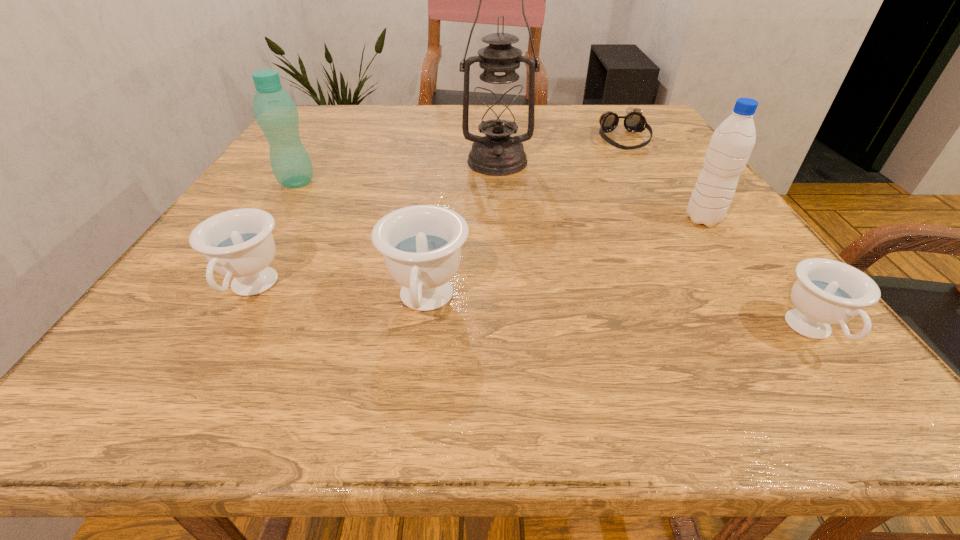
This screenshot has height=540, width=960. Find the location of `vacant area located on the back of the oil lamp`. vacant area located on the back of the oil lamp is located at coordinates (494, 114).

Locate an element on the screen. vacant region located 0.100m on the left of the water bottle is located at coordinates (633, 219).

This screenshot has width=960, height=540. Find the location of `free region located on the front of the bottle`. free region located on the front of the bottle is located at coordinates (214, 313).

Identify the location of object at the far edge. The height and width of the screenshot is (540, 960). (634, 121).

Locate an element on the screen. This screenshot has height=540, width=960. teacup positioned at the left edge is located at coordinates (238, 243).

Image resolution: width=960 pixels, height=540 pixels. I want to click on bottle at the left edge, so click(x=276, y=113).

What are the coordinates of `teacup that is at the right edge` in the screenshot? It's located at (827, 291).

This screenshot has width=960, height=540. In order to click on goggles at the right edge in this screenshot , I will do `click(634, 121)`.

Where is `water bottle located at the right edge`? water bottle located at the right edge is located at coordinates (731, 144).

Find the location of a particular element. The height and width of the screenshot is (540, 960). object that is at the near left corner is located at coordinates (238, 243).